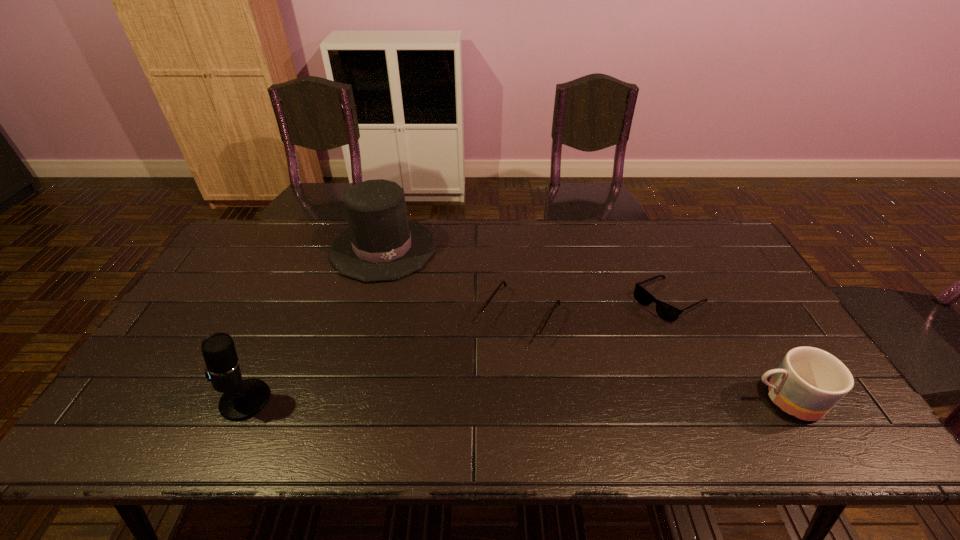
Where is `free space on the desktop that is between the leftmost object and the third tallest object and is positioned at the hinge ends of the spectacles`? free space on the desktop that is between the leftmost object and the third tallest object and is positioned at the hinge ends of the spectacles is located at coordinates (469, 400).

The height and width of the screenshot is (540, 960). Find the location of `free space on the desktop that is between the leftmost object and the third shortest object and is positioned on the front-facing side of the sunglasses`. free space on the desktop that is between the leftmost object and the third shortest object and is positioned on the front-facing side of the sunglasses is located at coordinates (542, 400).

Where is `free spot on the desktop that is between the microphone and the mug and is positioned on the front of the dress hat with the decoration`? The width and height of the screenshot is (960, 540). free spot on the desktop that is between the microphone and the mug and is positioned on the front of the dress hat with the decoration is located at coordinates (439, 400).